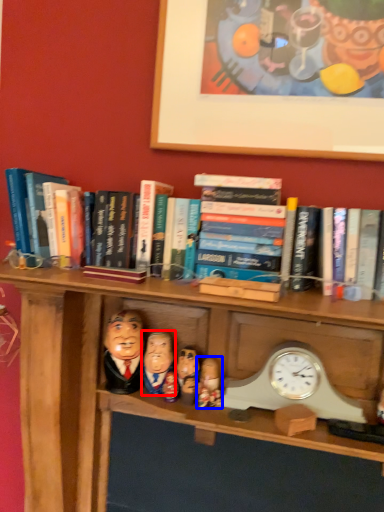
Question: Which of the following is the closest to the observer, person (highlighted by a red box) or person (highlighted by a blue box)?

Choices:
 (A) person
 (B) person

Answer: (A)